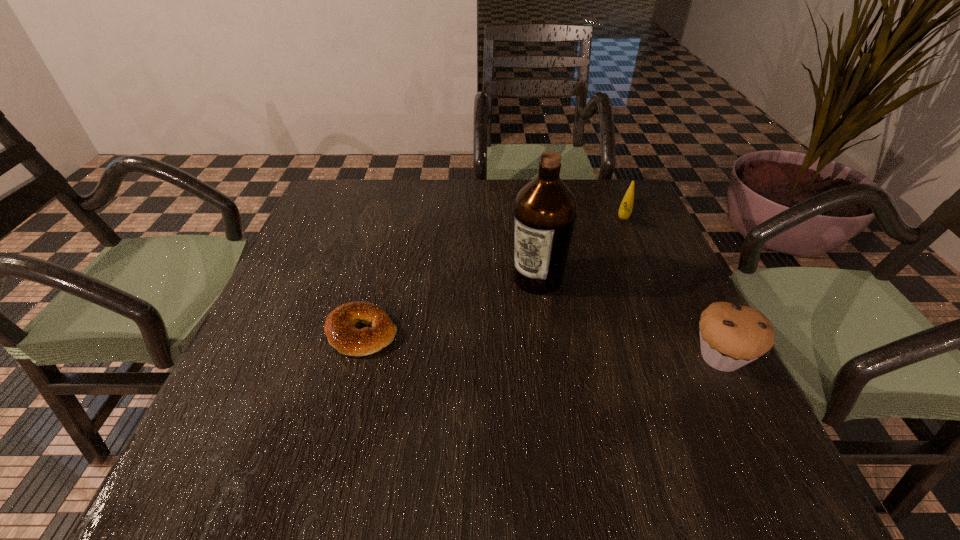
Where is `vacant space on the desktop that is between the leftmost object and the muffin and is positioned at the stem of the third tallest object`? vacant space on the desktop that is between the leftmost object and the muffin and is positioned at the stem of the third tallest object is located at coordinates click(585, 348).

At what (x,y) coordinates should I click in order to perform the action: click on vacant space on the desktop that is between the bagel and the muffin and is positioned on the label of the olive oil. Please return your answer as a coordinate pair (x, y). Image resolution: width=960 pixels, height=540 pixels. Looking at the image, I should click on (486, 341).